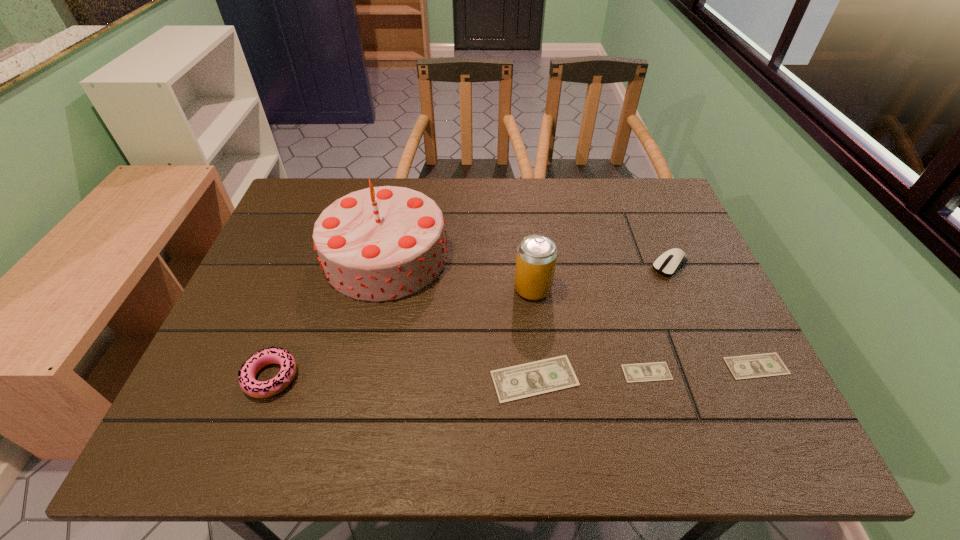
Where is `money that is positioned at the right edge`? The height and width of the screenshot is (540, 960). money that is positioned at the right edge is located at coordinates (769, 364).

Where is `mouse located in the right edge section of the desktop`? This screenshot has height=540, width=960. mouse located in the right edge section of the desktop is located at coordinates (x=668, y=263).

Where is `object at the near left corner`? The height and width of the screenshot is (540, 960). object at the near left corner is located at coordinates (258, 389).

Find the location of a particular element. object that is at the near right corner is located at coordinates (769, 364).

The image size is (960, 540). Find the location of `free space at the far edge of the desktop`. free space at the far edge of the desktop is located at coordinates (444, 206).

At what (x,y) coordinates should I click in order to perform the action: click on vacant space at the near edge of the desktop. Please return your answer as a coordinate pair (x, y). This screenshot has height=540, width=960. Looking at the image, I should click on click(476, 389).

Locate an element on the screen. vacant space at the left edge is located at coordinates (282, 324).

In the image, there is a desktop. Where is `vacant space at the near left corner`? vacant space at the near left corner is located at coordinates (212, 404).

Where is `free space at the far right corner`? This screenshot has height=540, width=960. free space at the far right corner is located at coordinates (657, 183).

In the image, there is a desktop. In order to click on vacant region at the near right corner in this screenshot , I will do `click(690, 394)`.